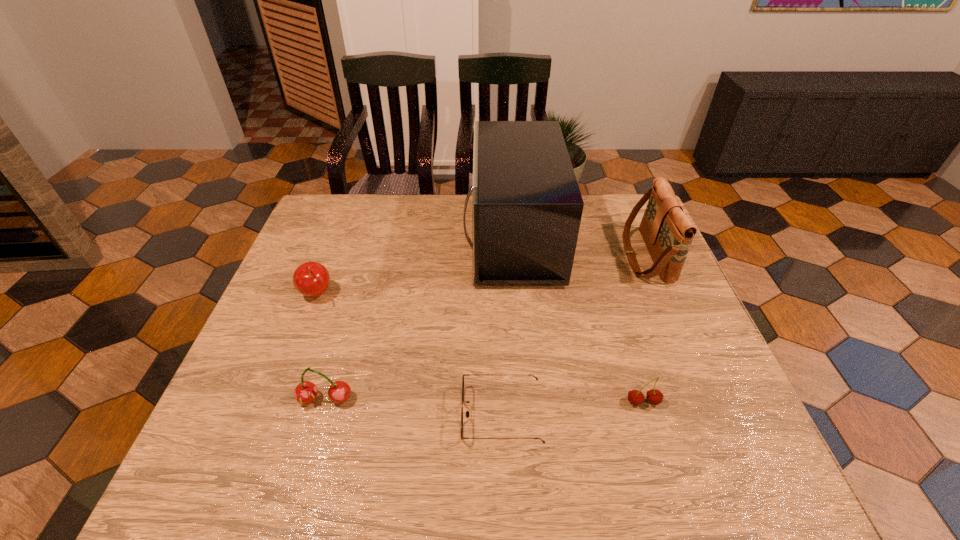
The height and width of the screenshot is (540, 960). What are the coordinates of `free space that satisfies the following two spatial constraints: 1. on the front-facing side of the rightmost object; 2. on the front side of the farthest cherry` in the screenshot? It's located at (662, 294).

Identify the location of vacant space that satisfies the following two spatial constraints: 1. on the front-facing side of the shoulder bag; 2. with stems pointing upwards on the fifth object from right to left. (707, 400).